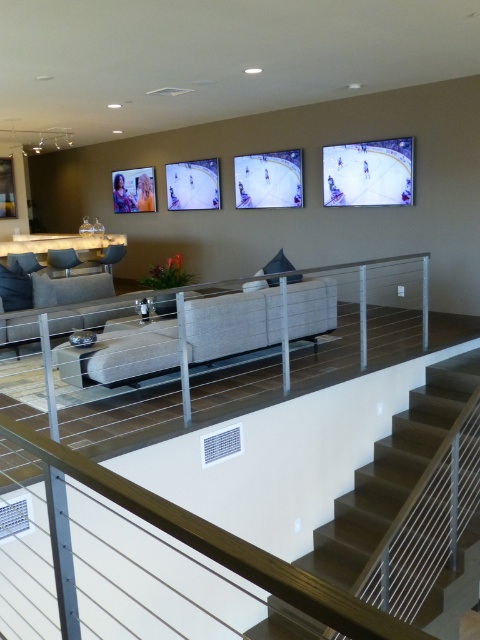
Locate an element on the screen. The image size is (480, 640). dark brown wooden stairs at center is located at coordinates (391, 472).

Who is positioned more to the left, dark brown wooden stairs at center or light gray fabric couch at center?

From the viewer's perspective, light gray fabric couch at center appears more on the left side.

What do you see at coordinates (391, 472) in the screenshot? I see `dark brown wooden stairs at center` at bounding box center [391, 472].

Where is `dark brown wooden stairs at center`? dark brown wooden stairs at center is located at coordinates (391, 472).